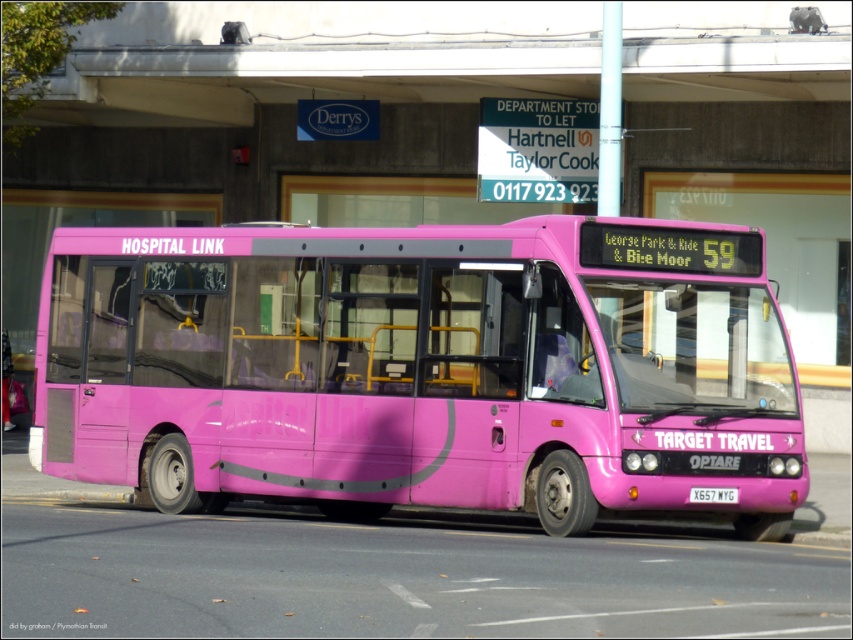
You are standing at a crosswalk and see the matte pink bus at center approaching. If the bus is 14.07 meters away from you, and you can walk at 1.5 meters per second, how many seconds do you have before the bus reaches you?

The matte pink bus at center is 14.07 meters away from the viewer. If you walk towards the bus at 1.5 meters per second, you would reach the bus in 14.07 divided by 1.5, which is approximately 9.38 seconds.

You are a passenger on the pink bus and want to get off at the next stop. The driver tells you that the next stop is located at one of these two points on the map displayed in the scene. Which point should you get off at, the point at coordinates (173, 337) or the point at (701, 490)?

The next stop is located at point (701, 490) because point (173, 337) is behind it, meaning the bus will pass point (701, 490) before reaching point (173, 337).

You are a delivery driver who needs to park your truck near the matte pink bus at center without blocking the pedestrian crossing. Based on the bus location at point 0.577, 0.497, can you determine if there is enough space to park safely?

The matte pink bus at center is located at point (422, 369). Since the bus is parked on the road near a pedestrian crossing, you should park your truck in a designated area away from the crossing to ensure safety and compliance with traffic rules.